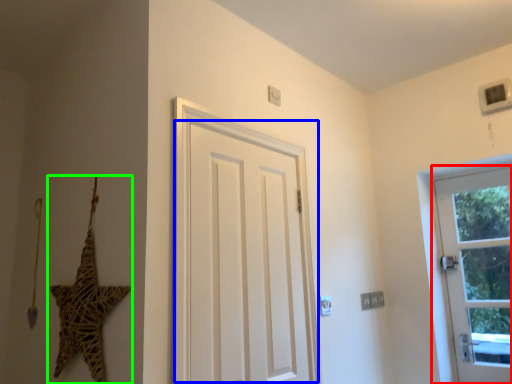
Question: Which is farther away from door (highlighted by a red box)? door (highlighted by a blue box) or star (highlighted by a green box)?

Choices:
 (A) door
 (B) star

Answer: (B)